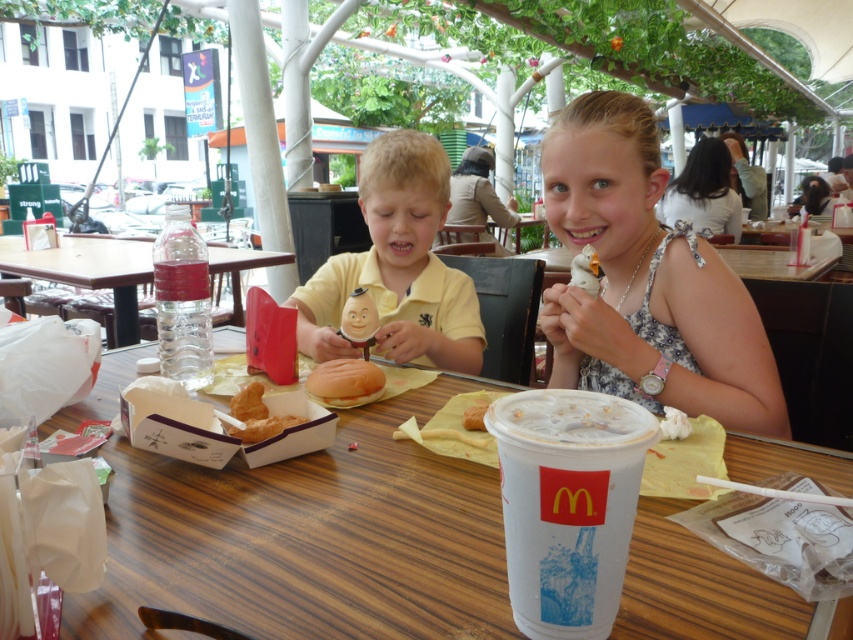
Question: Which object appears farthest from the camera in this image?

Choices:
 (A) golden bread roll at center
 (B) yellow matte shirt at center
 (C) white fabric dress at upper right
 (D) golden crispy chicken at center

Answer: (B)

Question: Based on their relative distances, which object is nearer to the dark brown hair at upper right?

Choices:
 (A) smooth brown hair at upper right
 (B) clear plastic bottle at center

Answer: (A)

Question: Is dark brown hair at upper right to the left of matte beige blouse at upper center from the viewer's perspective?

Choices:
 (A) no
 (B) yes

Answer: (A)

Question: Which object appears farthest from the camera in this image?

Choices:
 (A) white fabric dress at upper right
 (B) golden crispy chicken at center

Answer: (A)

Question: Does clear plastic bottle at center have a greater width compared to golden crispy bread at center?

Choices:
 (A) yes
 (B) no

Answer: (A)

Question: Does white fabric dress at upper right appear on the right side of light brown hair at upper right?

Choices:
 (A) yes
 (B) no

Answer: (B)